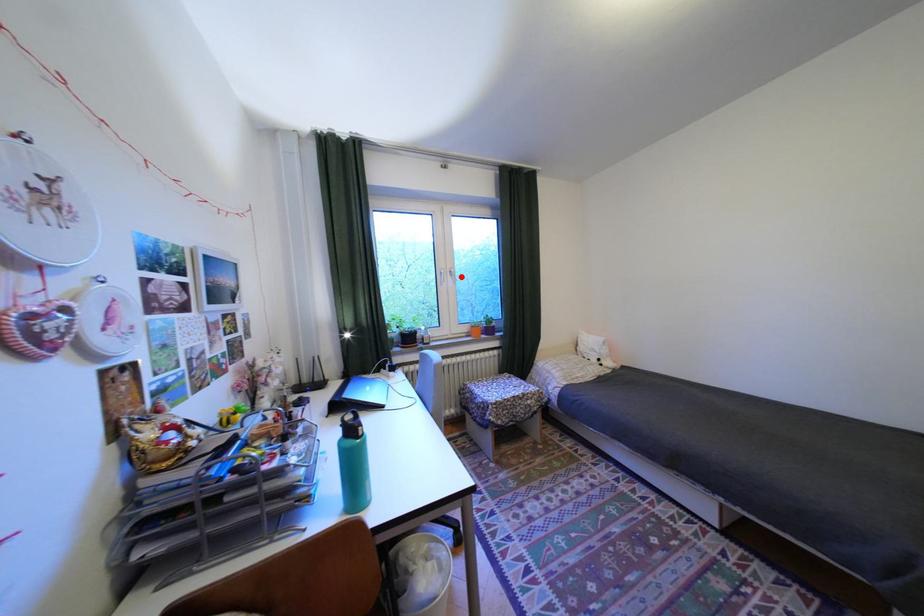
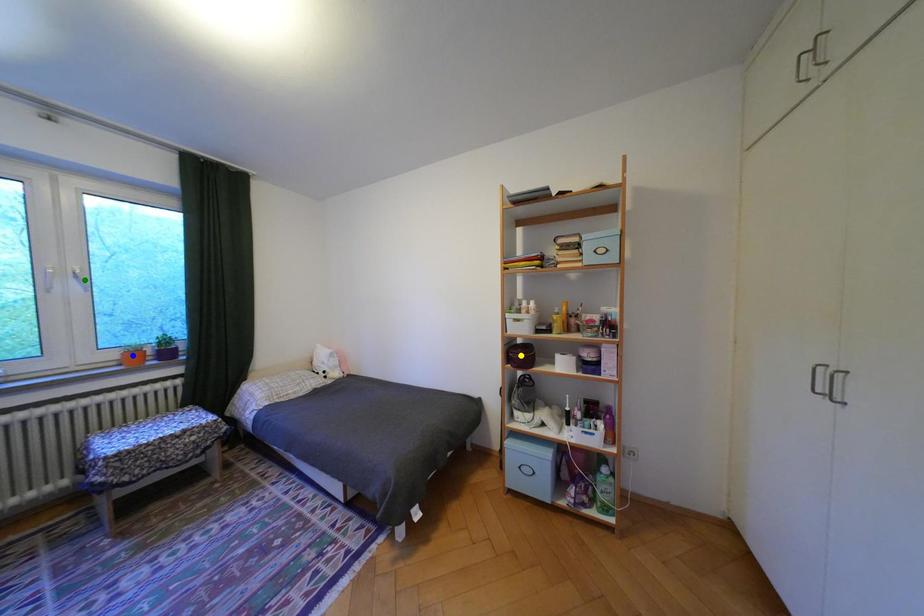
Question: I am providing you with two images of the same scene from different viewpoints. A red point is marked on the first image. You are given multiple points on the second image. In image 2, which mark is for the same physical point as the one in image 1?

Choices:
 (A) blue point
 (B) yellow point
 (C) green point

Answer: (C)